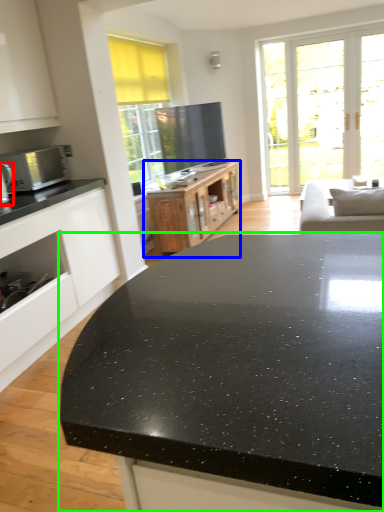
Question: Considering the real-world distances, which object is closest to appliance (highlighted by a red box)? cabinetry (highlighted by a blue box) or countertop (highlighted by a green box).

Choices:
 (A) cabinetry
 (B) countertop

Answer: (A)